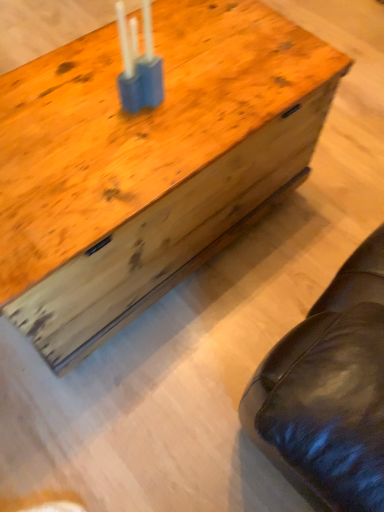
The image size is (384, 512). Describe the element at coordinates (148, 164) in the screenshot. I see `wooden trunk at center` at that location.

You are a GUI agent. You are given a task and a screenshot of the screen. Output one action in this format:
    pyautogui.click(x=<x>, y=<y>)
    Task: Click on the wooden trunk at center
    This screenshot has width=384, height=512.
    Given the screenshot: What is the action you would take?
    pyautogui.click(x=148, y=164)

Where is `blue plastic candle holder at center`? blue plastic candle holder at center is located at coordinates (139, 64).

Measure the distance between blue plastic candle holder at center and camera.

blue plastic candle holder at center and camera are 31.21 inches apart.

This screenshot has height=512, width=384. Describe the element at coordinates (139, 64) in the screenshot. I see `blue plastic candle holder at center` at that location.

Locate an element on the screen. This screenshot has height=512, width=384. wooden trunk at center is located at coordinates click(148, 164).

Is wooden trunk at center at the left side of blue plastic candle holder at center?

Correct, you'll find wooden trunk at center to the left of blue plastic candle holder at center.

Is wooden trunk at center closer to the viewer compared to blue plastic candle holder at center?

Yes, wooden trunk at center is closer to the viewer.

Considering the points (337, 51) and (148, 69), which point is in front, point (337, 51) or point (148, 69)?

The point (148, 69) is closer.

From the image's perspective, which object appears higher, wooden trunk at center or blue plastic candle holder at center?

blue plastic candle holder at center appears higher in the image.

From a real-world perspective, which is physically above, wooden trunk at center or blue plastic candle holder at center?

blue plastic candle holder at center is physically above.

Can you confirm if wooden trunk at center is thinner than blue plastic candle holder at center?

Incorrect, the width of wooden trunk at center is not less than that of blue plastic candle holder at center.

Does wooden trunk at center have a greater height compared to blue plastic candle holder at center?

Yes, wooden trunk at center is taller than blue plastic candle holder at center.

Based on their sizes in the image, would you say wooden trunk at center is bigger or smaller than blue plastic candle holder at center?

Clearly, wooden trunk at center is larger in size than blue plastic candle holder at center.

Can we say wooden trunk at center lies outside blue plastic candle holder at center?

wooden trunk at center lies outside blue plastic candle holder at center's area.

Would you say wooden trunk at center is a long distance from blue plastic candle holder at center?

Actually, wooden trunk at center and blue plastic candle holder at center are a little close together.

Based on the photo, is wooden trunk at center aimed at blue plastic candle holder at center?

No, wooden trunk at center is not turned towards blue plastic candle holder at center.

Where is `table lying on the left of blue plastic candle holder at center`? table lying on the left of blue plastic candle holder at center is located at coordinates (148, 164).

Considering the positions of objects blue plastic candle holder at center and wooden trunk at center in the image provided, who is more to the left, blue plastic candle holder at center or wooden trunk at center?

Positioned to the left is wooden trunk at center.

Is blue plastic candle holder at center positioned before wooden trunk at center?

No.

Is point (123, 58) more distant than point (166, 69)?

No.

From the image's perspective, relative to wooden trunk at center, is blue plastic candle holder at center above or below?

blue plastic candle holder at center is situated higher than wooden trunk at center in the image.

From a real-world perspective, is blue plastic candle holder at center beneath wooden trunk at center?

No, from a real-world perspective, blue plastic candle holder at center is not beneath wooden trunk at center.

Looking at their sizes, would you say blue plastic candle holder at center is wider or thinner than wooden trunk at center?

Clearly, blue plastic candle holder at center has less width compared to wooden trunk at center.

Considering the relative sizes of blue plastic candle holder at center and wooden trunk at center in the image provided, is blue plastic candle holder at center shorter than wooden trunk at center?

Indeed, blue plastic candle holder at center has a lesser height compared to wooden trunk at center.

Based on their sizes in the image, would you say blue plastic candle holder at center is bigger or smaller than wooden trunk at center?

blue plastic candle holder at center is smaller than wooden trunk at center.

Looking at this image, is blue plastic candle holder at center inside the boundaries of wooden trunk at center, or outside?

The correct answer is: outside.

Is blue plastic candle holder at center far from wooden trunk at center?

No, blue plastic candle holder at center is not far from wooden trunk at center.

Could you tell me if blue plastic candle holder at center is facing wooden trunk at center?

No, blue plastic candle holder at center is not turned towards wooden trunk at center.

Based on the photo, can you tell me how much blue plastic candle holder at center and wooden trunk at center differ in facing direction?

There is a 2.98-degree angle between the facing directions of blue plastic candle holder at center and wooden trunk at center.

The height and width of the screenshot is (512, 384). Find the location of `candle holder located on the right of wooden trunk at center`. candle holder located on the right of wooden trunk at center is located at coordinates (139, 64).

At what (x,y) coordinates should I click in order to perform the action: click on candle holder behind the wooden trunk at center. Please return your answer as a coordinate pair (x, y). The width and height of the screenshot is (384, 512). Looking at the image, I should click on (139, 64).

Find the location of a particular element. The width and height of the screenshot is (384, 512). table lying on the left of blue plastic candle holder at center is located at coordinates (148, 164).